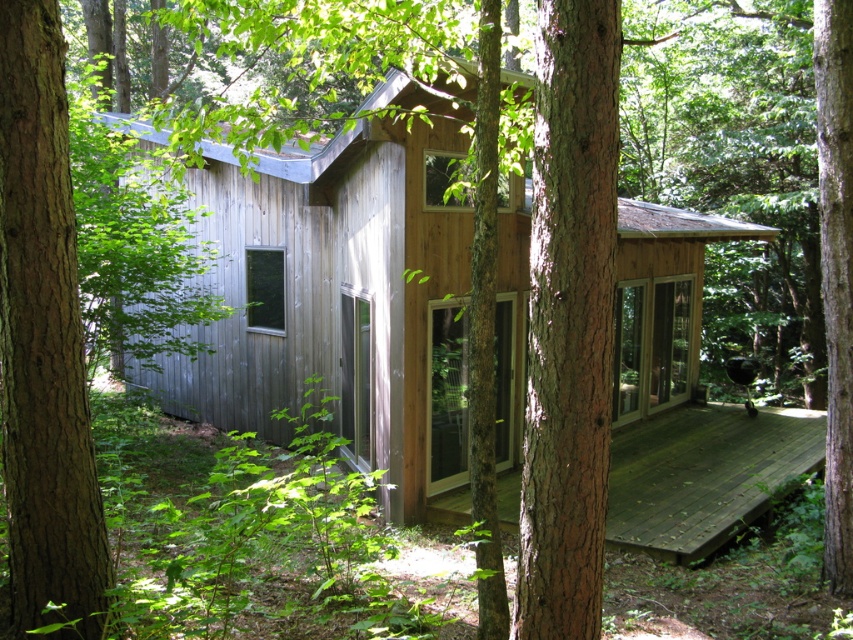
Can you confirm if brown rough bark tree at center is thinner than brown rough tree trunk at center?

Incorrect, brown rough bark tree at center's width is not less than brown rough tree trunk at center's.

Does brown rough bark tree at center appear on the left side of brown rough tree trunk at center?

Yes, brown rough bark tree at center is to the left of brown rough tree trunk at center.

Between point (521, 580) and point (822, 200), which one is positioned behind?

The point (822, 200) is more distant.

Identify the location of brown rough bark tree at center. (569, 321).

The image size is (853, 640). What do you see at coordinates (569, 321) in the screenshot? I see `brown rough bark tree at center` at bounding box center [569, 321].

Locate an element on the screen. Image resolution: width=853 pixels, height=640 pixels. brown rough bark tree at center is located at coordinates (569, 321).

Who is shorter, brown rough tree trunk at left or brown rough tree trunk at center?

With less height is brown rough tree trunk at left.

What are the coordinates of `brown rough tree trunk at left` in the screenshot? It's located at (44, 340).

The image size is (853, 640). I want to click on brown rough tree trunk at left, so click(44, 340).